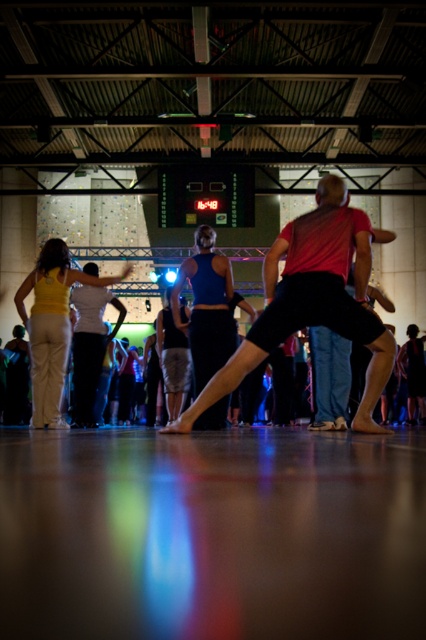
Question: Considering the real-world distances, which object is farthest from the blue fabric skirt at center?

Choices:
 (A) matte black shorts at center
 (B) matte yellow tank top at center

Answer: (A)

Question: Is matte black shorts at center bigger than matte yellow tank top at center?

Choices:
 (A) no
 (B) yes

Answer: (A)

Question: Does matte black shorts at center lie in front of blue fabric skirt at center?

Choices:
 (A) no
 (B) yes

Answer: (B)

Question: Does matte yellow tank top at center have a lesser width compared to blue fabric skirt at center?

Choices:
 (A) yes
 (B) no

Answer: (B)

Question: Which of the following is the farthest from the observer?

Choices:
 (A) (203, 289)
 (B) (78, 269)

Answer: (B)

Question: Which point is closer to the camera taking this photo?

Choices:
 (A) (333, 284)
 (B) (193, 266)
 (C) (57, 397)

Answer: (A)